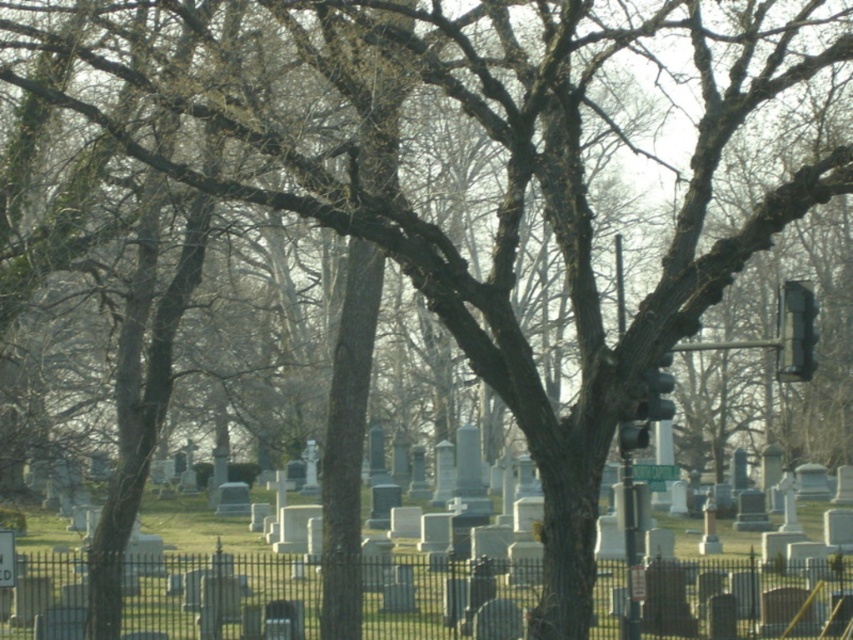
Is white stone gravestones at center to the right of black plastic traffic light at right from the viewer's perspective?

In fact, white stone gravestones at center is to the left of black plastic traffic light at right.

Does white stone gravestones at center appear on the left side of black plastic traffic light at right?

Yes, white stone gravestones at center is to the left of black plastic traffic light at right.

Which is in front, point (824, 636) or point (801, 296)?

Point (801, 296) is more forward.

Where is `white stone gravestones at center`? The image size is (853, 640). white stone gravestones at center is located at coordinates (746, 596).